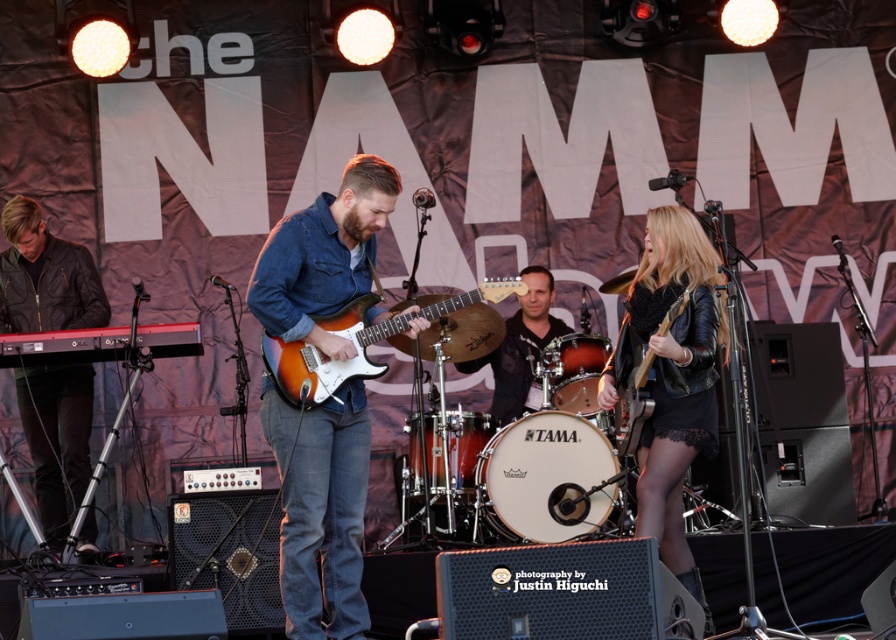
From the picture: Measure the distance between point (x=40, y=486) and camera.

6.94 meters

At what (x,y) coordinates should I click in order to perform the action: click on black leather jacket at left. Please return your answer as a coordinate pair (x, y). This screenshot has height=640, width=896. Looking at the image, I should click on (45, 276).

Image resolution: width=896 pixels, height=640 pixels. Describe the element at coordinates (45, 276) in the screenshot. I see `black leather jacket at left` at that location.

Find the location of a particular element. black leather jacket at left is located at coordinates (45, 276).

Does orange wood electric guitar at center come behind shiny black guitar at center?

No, it is not.

Between orange wood electric guitar at center and shiny black guitar at center, which one has more height?

With more height is shiny black guitar at center.

The image size is (896, 640). I want to click on orange wood electric guitar at center, so click(332, 349).

Locate an element on the screen. Image resolution: width=896 pixels, height=640 pixels. orange wood electric guitar at center is located at coordinates (332, 349).

Who is lower down, shiny black guitar at center or matte red drum at center?

shiny black guitar at center is lower down.

What do you see at coordinates (632, 388) in the screenshot?
I see `shiny black guitar at center` at bounding box center [632, 388].

The image size is (896, 640). Find the location of `shiny black guitar at center`. shiny black guitar at center is located at coordinates (632, 388).